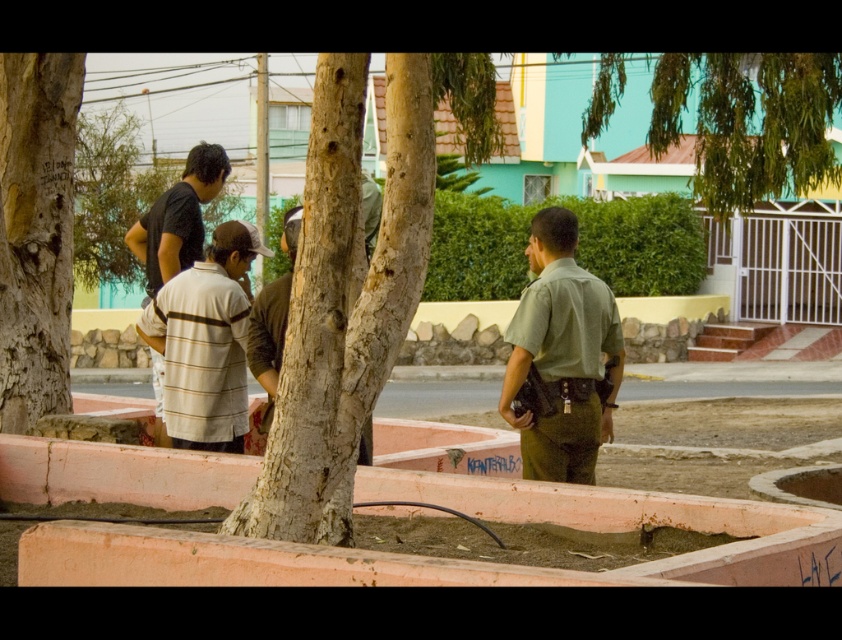
You are a photographer standing at the camera position. You want to take a photo that includes both the point at coordinates point (3, 417) and point (576, 221). Which point will appear closer to the front of the photo?

Point (3, 417) is further to the camera than point (576, 221), so in the photo, point (3, 417) will appear closer to the front of the photo.

You are a painter standing 30 inches away from the striped cotton shirt at left. You want to paint the brown rough bark tree at left without moving your position. Is the tree within your painting range?

The brown rough bark tree at left is 28.03 inches from striped cotton shirt at left. Since you are 30 inches away from the striped cotton shirt at left, the tree is within your painting range as it is only 28.03 inches away from the shirt, which is less than your 30 inches distance.